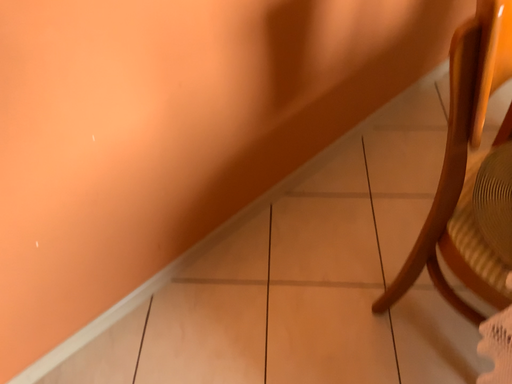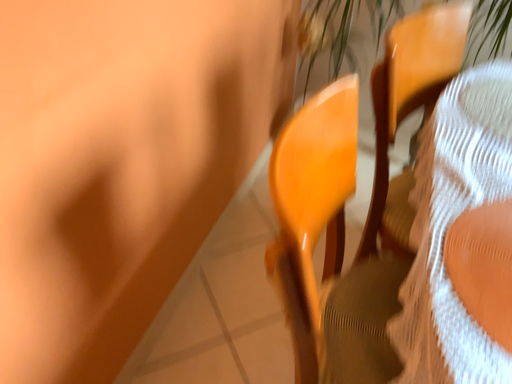
Question: How did the camera likely rotate when shooting the video?

Choices:
 (A) rotated downward
 (B) rotated upward

Answer: (B)